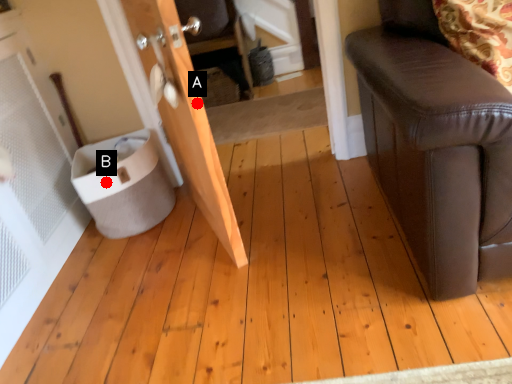
Question: Two points are circled on the image, labeled by A and B beside each circle. Which point is closer to the camera?

Choices:
 (A) A is closer
 (B) B is closer

Answer: (A)